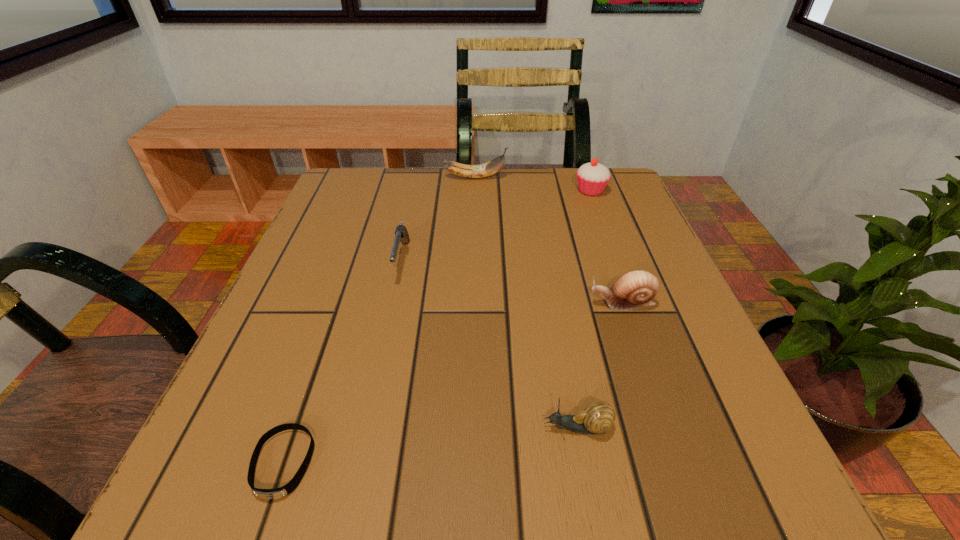
Locate an element on the screen. This screenshot has height=540, width=960. banana at the far edge is located at coordinates (492, 167).

Locate an element on the screen. cupcake at the far edge is located at coordinates click(592, 178).

I want to click on object located at the near edge, so click(269, 494).

The height and width of the screenshot is (540, 960). In order to click on object at the left edge in this screenshot , I will do `click(269, 494)`.

In order to click on cupcake located in the right edge section of the desktop in this screenshot , I will do `click(592, 178)`.

The image size is (960, 540). What are the coordinates of `escargot at the right edge` in the screenshot? It's located at (636, 289).

Where is `object that is at the near left corner`? object that is at the near left corner is located at coordinates (269, 494).

Where is `object that is positioned at the far right corner`? Image resolution: width=960 pixels, height=540 pixels. object that is positioned at the far right corner is located at coordinates (592, 178).

Where is `free spot at the far edge of the desktop`? free spot at the far edge of the desktop is located at coordinates (454, 199).

Locate an element on the screen. vacant space at the near edge of the desktop is located at coordinates (486, 491).